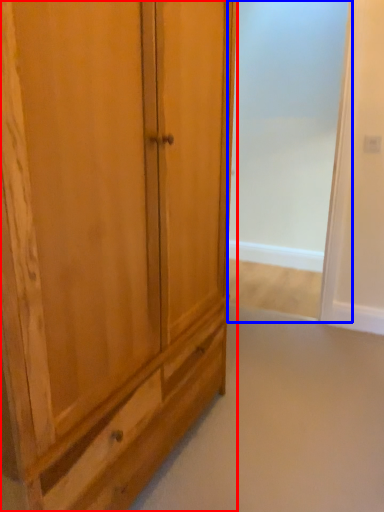
Question: Which object is further to the camera taking this photo, cupboard (highlighted by a red box) or screen door (highlighted by a blue box)?

Choices:
 (A) cupboard
 (B) screen door

Answer: (B)